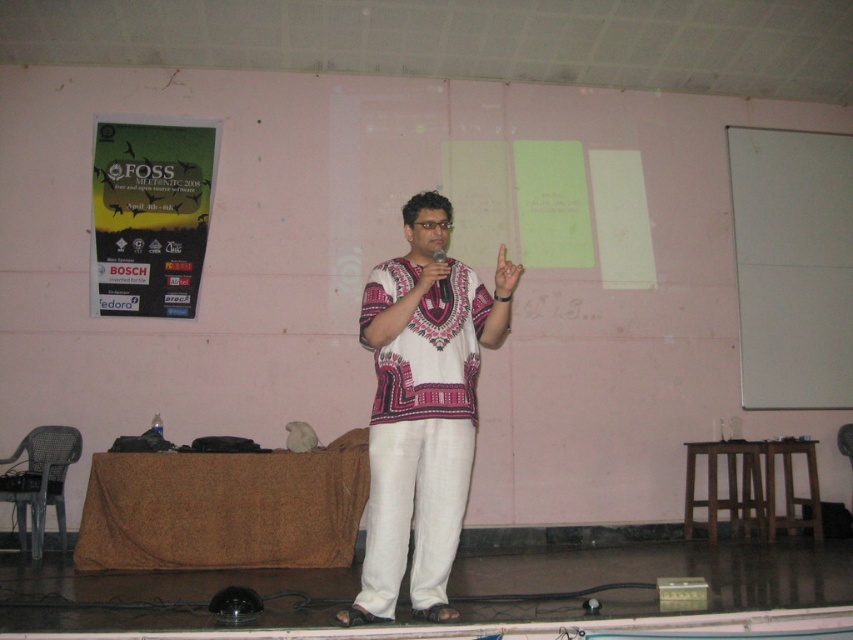
Question: Which point is farther from the camera taking this photo?

Choices:
 (A) (840, 332)
 (B) (496, 268)

Answer: (A)

Question: Is paper poster at left smaller than white matte hand at center?

Choices:
 (A) no
 (B) yes

Answer: (A)

Question: Estimate the real-world distances between objects in this image. Which object is closer to the white matte hand at center?

Choices:
 (A) paper poster at left
 (B) white cotton shirt at center

Answer: (B)

Question: Does white smooth board at right have a smaller size compared to white matte hand at center?

Choices:
 (A) no
 (B) yes

Answer: (A)

Question: In this image, where is white smooth board at right located relative to white matte hand at center?

Choices:
 (A) below
 (B) above

Answer: (B)

Question: Which point is closer to the camera?

Choices:
 (A) paper poster at left
 (B) white smooth board at right

Answer: (A)